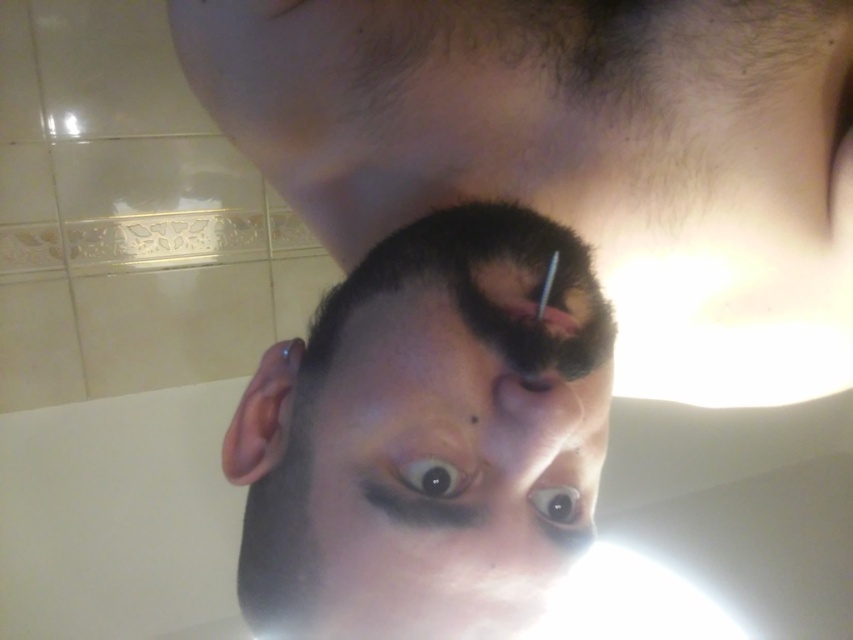
Is point (573, 435) positioned before point (457, 504)?

No, it is not.

Which is more to the left, shiny black hair at center or dark brown hair at center?

From the viewer's perspective, shiny black hair at center appears more on the left side.

Does point (543, 412) come behind point (445, 513)?

That is True.

You are a GUI agent. You are given a task and a screenshot of the screen. Output one action in this format:
    pyautogui.click(x=<x>, y=<y>)
    Task: Click on the shiny black hair at center
    The height and width of the screenshot is (640, 853).
    Given the screenshot: What is the action you would take?
    pyautogui.click(x=426, y=433)

Is smooth skin at center above dark brown hair at center?

Indeed, smooth skin at center is positioned over dark brown hair at center.

Is point (337, 369) closer to viewer compared to point (363, 481)?

No, (337, 369) is behind (363, 481).

You are a GUI agent. You are given a task and a screenshot of the screen. Output one action in this format:
    pyautogui.click(x=<x>, y=<y>)
    Task: Click on the smooth skin at center
    The image size is (853, 640).
    Given the screenshot: What is the action you would take?
    pyautogui.click(x=407, y=332)

Is black glossy eye at center to the right of brown glossy eye at center from the viewer's perspective?

Incorrect, black glossy eye at center is not on the right side of brown glossy eye at center.

Between point (397, 477) and point (569, 497), which one is positioned in front?

Point (397, 477)

Find the location of a particular element. The image size is (853, 640). black glossy eye at center is located at coordinates (434, 476).